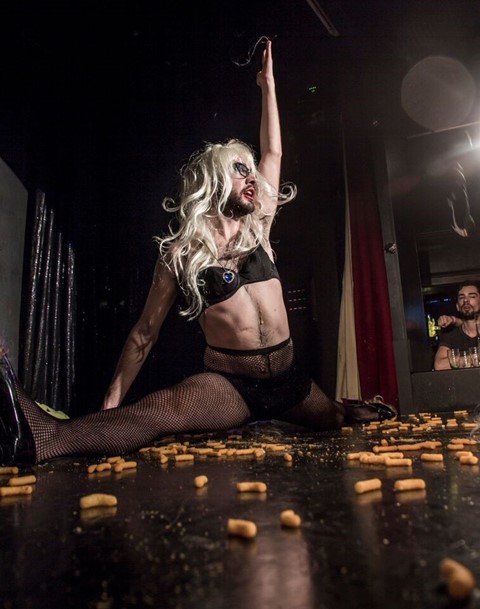
The width and height of the screenshot is (480, 609). I want to click on curtain, so click(x=76, y=346).